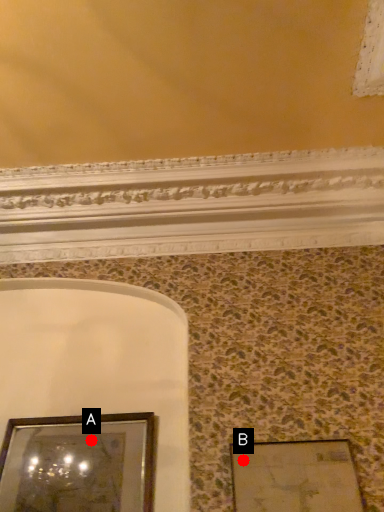
Question: Two points are circled on the image, labeled by A and B beside each circle. Which point is farther to the camera?

Choices:
 (A) A is further
 (B) B is further

Answer: (A)